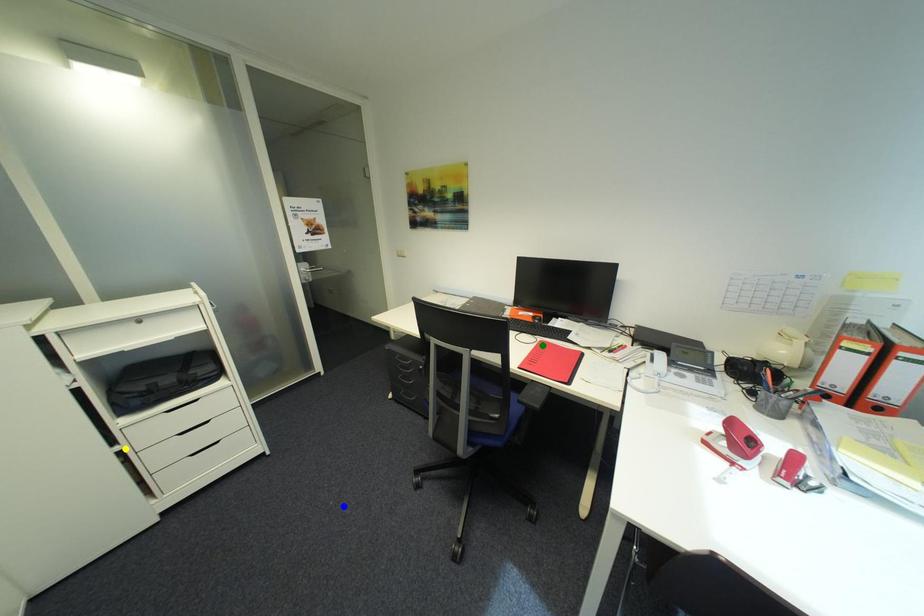
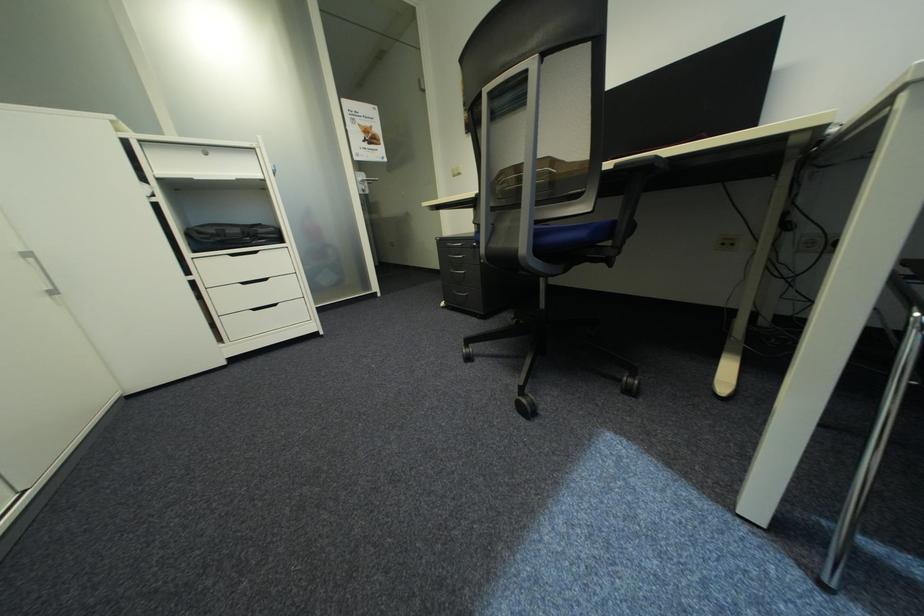
I am providing you with two images of the same scene from different viewpoints. Three points are marked in image1. Which point corresponds to a part or object that is occluded in image2?In image1, three points are marked. Which of them correspond to a part or object that is occluded in image2?Among the three points shown in image1, which one corresponds to a part or object that is no longer visible due to occlusion in image2?

green point